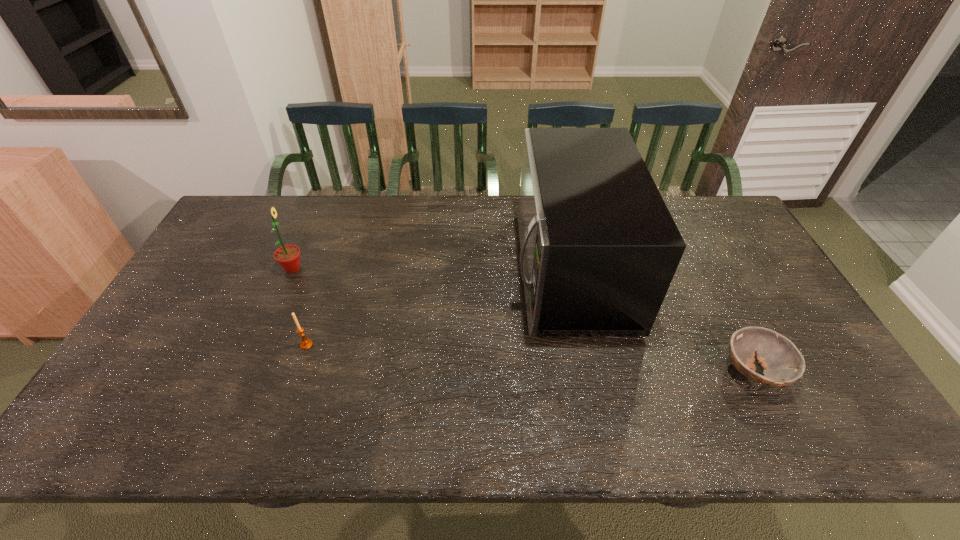
Where is `free space that satisfies the following two spatial constraints: 1. with the door open on the third object from left to right; 2. on the front side of the third object from right to left`? Image resolution: width=960 pixels, height=540 pixels. free space that satisfies the following two spatial constraints: 1. with the door open on the third object from left to right; 2. on the front side of the third object from right to left is located at coordinates 584,345.